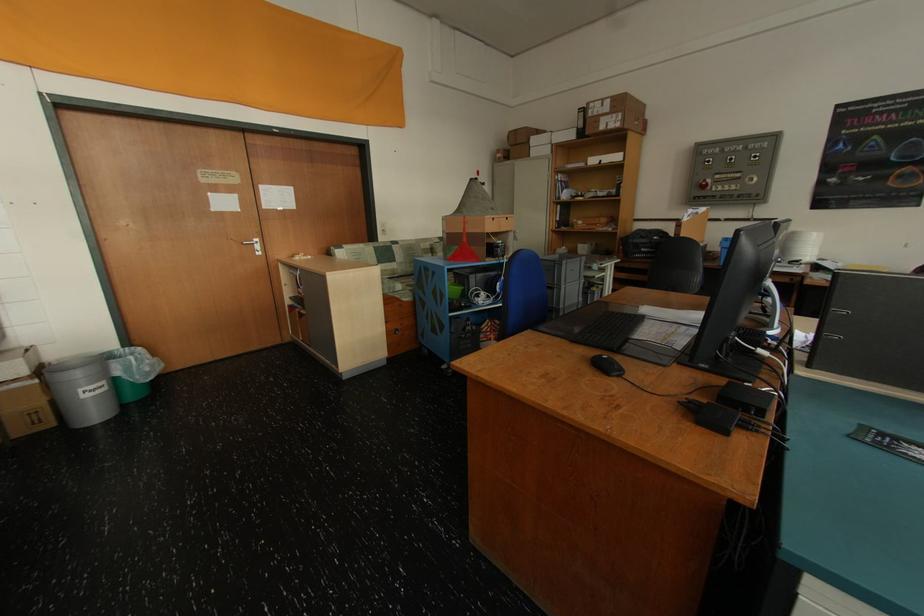
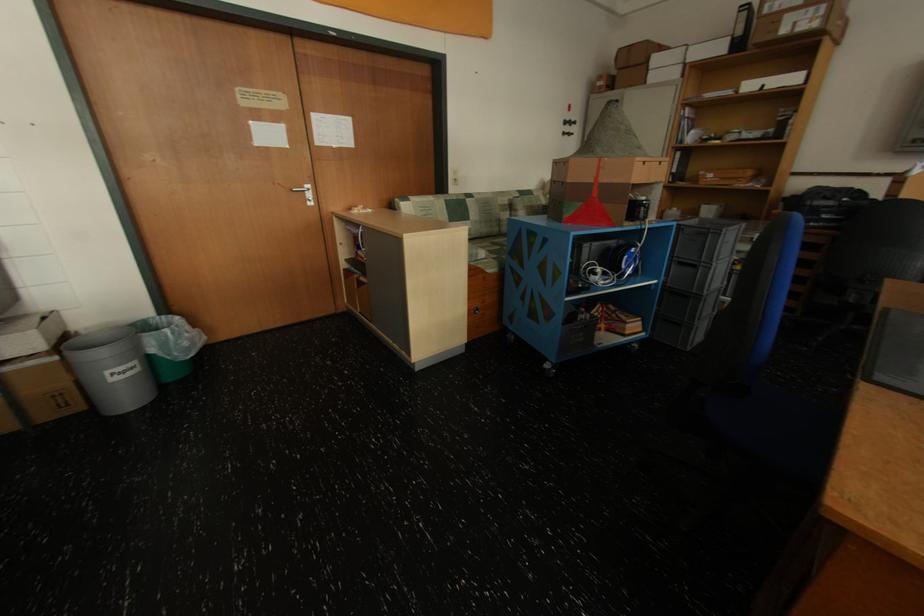
Where in the second image is the point corresponding to the point at 140,359 from the first image?

(176, 331)